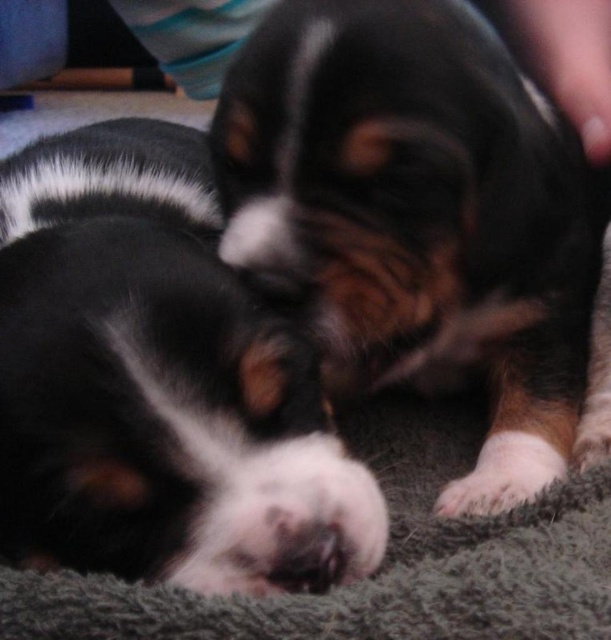
Question: Based on their relative distances, which object is farther from the white fur at lower right?

Choices:
 (A) gray fuzzy blanket at lower center
 (B) soft brown fur at center

Answer: (B)

Question: From the image, what is the correct spatial relationship of soft brown fur at center in relation to black fur dog at center?

Choices:
 (A) right
 (B) left

Answer: (A)

Question: Which point is farther from the camera taking this photo?

Choices:
 (A) (524, 464)
 (B) (370, 52)
 (C) (430, 556)
 (D) (16, 497)

Answer: (A)

Question: Which object is closer to the camera taking this photo?

Choices:
 (A) gray fuzzy blanket at lower center
 (B) white fur at lower right
 (C) soft brown fur at center
 (D) black fur dog at center

Answer: (A)

Question: Is soft brown fur at center positioned at the back of gray fuzzy blanket at lower center?

Choices:
 (A) no
 (B) yes

Answer: (B)

Question: In this image, where is soft brown fur at center located relative to black fur dog at center?

Choices:
 (A) below
 (B) above

Answer: (B)